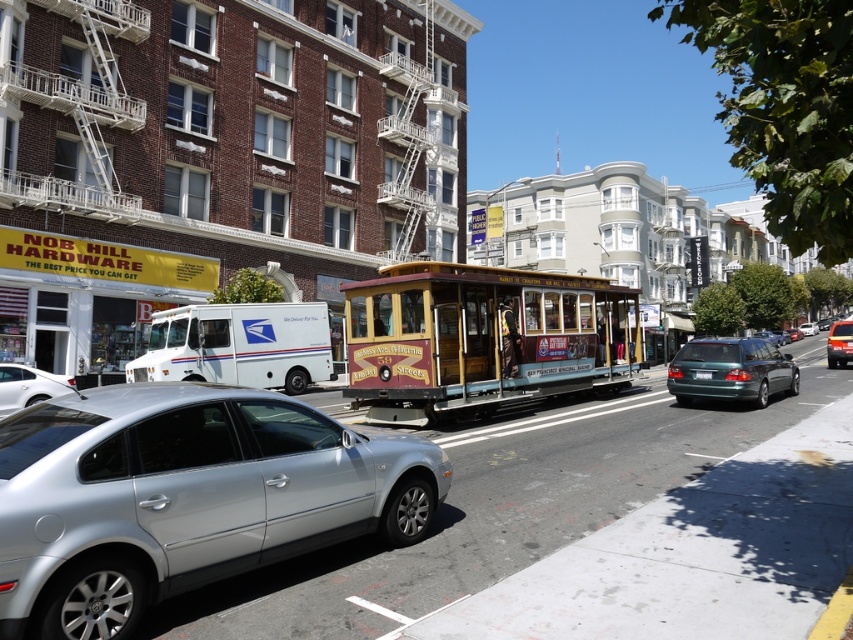
Question: Observing the image, what is the correct spatial positioning of silver metallic sedan at lower left in reference to metallic silver sedan at center?

Choices:
 (A) above
 (B) below

Answer: (B)

Question: Can you confirm if wooden polished cable car at center is positioned to the right of green matte sedan at lower right?

Choices:
 (A) yes
 (B) no

Answer: (B)

Question: Among these points, which one is farthest from the camera?

Choices:
 (A) (471, 292)
 (B) (271, 532)
 (C) (758, 381)
 (D) (845, 360)

Answer: (D)

Question: Which object appears farthest from the camera in this image?

Choices:
 (A) wooden polished cable car at center
 (B) silver metallic sedan at lower left
 (C) metallic silver sedan at center
 (D) green matte sedan at lower right

Answer: (C)

Question: Which object appears closest to the camera in this image?

Choices:
 (A) silver metallic car at lower left
 (B) wooden polished cable car at center
 (C) silver metallic sedan at lower left
 (D) metallic silver sedan at center

Answer: (A)

Question: Is the position of silver metallic car at lower left less distant than that of silver metallic sedan at lower left?

Choices:
 (A) no
 (B) yes

Answer: (B)